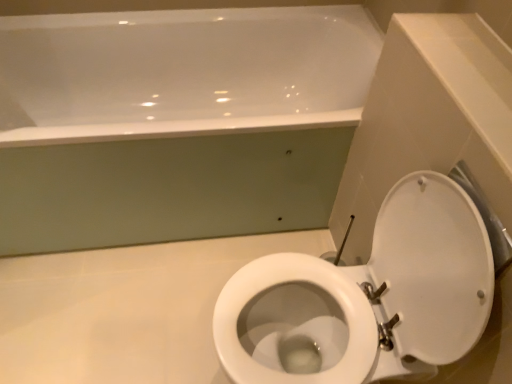
Locate an element on the screen. The height and width of the screenshot is (384, 512). white glossy bathtub at upper center is located at coordinates (176, 123).

What is the approximate height of white glossy bathtub at upper center?

white glossy bathtub at upper center is 23.17 inches tall.

What do you see at coordinates (176, 123) in the screenshot? I see `white glossy bathtub at upper center` at bounding box center [176, 123].

The height and width of the screenshot is (384, 512). Describe the element at coordinates (369, 296) in the screenshot. I see `white glossy toilet at lower right` at that location.

At what (x,y) coordinates should I click in order to perform the action: click on white glossy toilet at lower right. Please return your answer as a coordinate pair (x, y). The height and width of the screenshot is (384, 512). Looking at the image, I should click on (369, 296).

Where is `white glossy bathtub at upper center`? The image size is (512, 384). white glossy bathtub at upper center is located at coordinates (176, 123).

From the picture: Can you confirm if white glossy bathtub at upper center is positioned to the right of white glossy toilet at lower right?

No, white glossy bathtub at upper center is not to the right of white glossy toilet at lower right.

Consider the image. Considering the relative positions of white glossy bathtub at upper center and white glossy toilet at lower right in the image provided, is white glossy bathtub at upper center in front of white glossy toilet at lower right?

No, the depth of white glossy bathtub at upper center is greater than that of white glossy toilet at lower right.

Which is nearer, (x=76, y=162) or (x=348, y=288)?

The point (x=348, y=288) is closer.

From the picture: From the image's perspective, does white glossy bathtub at upper center appear lower than white glossy toilet at lower right?

No, from the image's perspective, white glossy bathtub at upper center is not below white glossy toilet at lower right.

From a real-world perspective, is white glossy bathtub at upper center physically located above or below white glossy toilet at lower right?

From a real-world perspective, white glossy bathtub at upper center is physically below white glossy toilet at lower right.

In terms of width, does white glossy bathtub at upper center look wider or thinner when compared to white glossy toilet at lower right?

Considering their sizes, white glossy bathtub at upper center looks broader than white glossy toilet at lower right.

Considering the sizes of white glossy bathtub at upper center and white glossy toilet at lower right in the image, is white glossy bathtub at upper center taller or shorter than white glossy toilet at lower right?

Clearly, white glossy bathtub at upper center is shorter compared to white glossy toilet at lower right.

Considering the sizes of objects white glossy bathtub at upper center and white glossy toilet at lower right in the image provided, who is bigger, white glossy bathtub at upper center or white glossy toilet at lower right?

white glossy bathtub at upper center is bigger.

Would you say white glossy bathtub at upper center contains white glossy toilet at lower right?

No, white glossy toilet at lower right is located outside of white glossy bathtub at upper center.

Would you say white glossy bathtub at upper center is a long distance from white glossy toilet at lower right?

No.

Could you tell me if white glossy bathtub at upper center is facing white glossy toilet at lower right?

Yes, white glossy bathtub at upper center is turned towards white glossy toilet at lower right.

Find the location of `bathtub lying on the left of white glossy toilet at lower right`. bathtub lying on the left of white glossy toilet at lower right is located at coordinates (176, 123).

Is white glossy toilet at lower right to the left of white glossy bathtub at upper center from the viewer's perspective?

No.

Is white glossy toilet at lower right in front of or behind white glossy bathtub at upper center in the image?

white glossy toilet at lower right is positioned closer to the viewer than white glossy bathtub at upper center.

Which is farther, (443, 328) or (218, 198)?

The point (218, 198) is farther.

From the image's perspective, is white glossy toilet at lower right located above white glossy bathtub at upper center?

No, from the image's perspective, white glossy toilet at lower right is not above white glossy bathtub at upper center.

From a real-world perspective, which is physically below, white glossy toilet at lower right or white glossy bathtub at upper center?

From a 3D spatial view, white glossy bathtub at upper center is below.

Is white glossy toilet at lower right wider than white glossy bathtub at upper center?

No, white glossy toilet at lower right is not wider than white glossy bathtub at upper center.

Considering the sizes of objects white glossy toilet at lower right and white glossy bathtub at upper center in the image provided, who is shorter, white glossy toilet at lower right or white glossy bathtub at upper center?

white glossy bathtub at upper center.

Who is smaller, white glossy toilet at lower right or white glossy bathtub at upper center?

white glossy toilet at lower right.

Is white glossy bathtub at upper center surrounded by white glossy toilet at lower right?

No, white glossy bathtub at upper center is not a part of white glossy toilet at lower right.

Is the surface of white glossy toilet at lower right in direct contact with white glossy bathtub at upper center?

white glossy toilet at lower right is not next to white glossy bathtub at upper center, and they're not touching.

Is white glossy toilet at lower right oriented towards white glossy bathtub at upper center?

No, white glossy toilet at lower right is not facing towards white glossy bathtub at upper center.

What are the coordinates of `toilet below the white glossy bathtub at upper center (from the image's perspective)` in the screenshot? It's located at (369, 296).

Find the location of a particular element. bathtub behind the white glossy toilet at lower right is located at coordinates (176, 123).

Where is `toilet that appears on the right of white glossy bathtub at upper center`? The image size is (512, 384). toilet that appears on the right of white glossy bathtub at upper center is located at coordinates (369, 296).